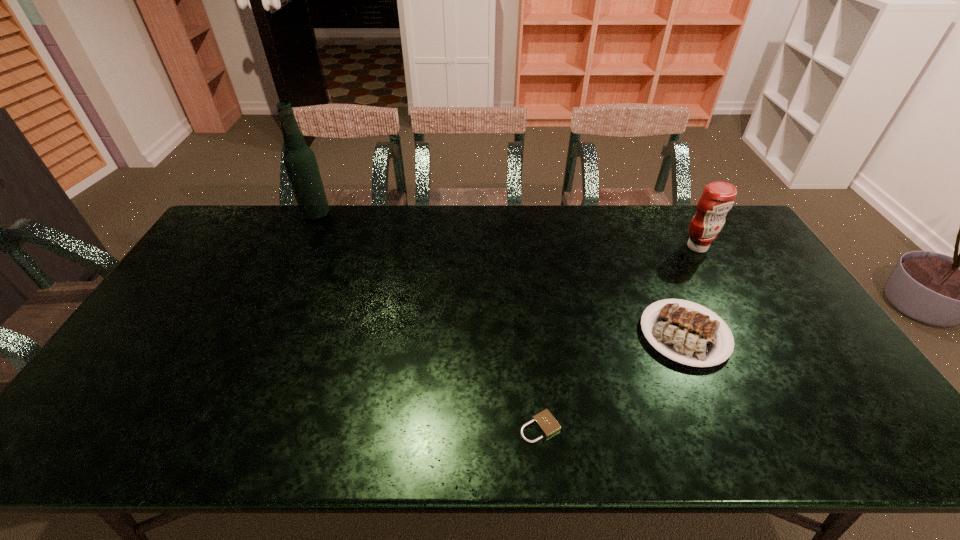
The width and height of the screenshot is (960, 540). In the image, there is a desktop. In order to click on vacant area at the far left corner in this screenshot , I will do `click(264, 212)`.

Find the location of a particular element. Image resolution: width=960 pixels, height=540 pixels. free space between the condiment and the plate is located at coordinates (691, 291).

Find the location of `free space between the nearest object and the leftmost object`. free space between the nearest object and the leftmost object is located at coordinates (428, 321).

Locate an element on the screen. The image size is (960, 540). vacant area that lies between the third nearest object and the padlock is located at coordinates (619, 337).

Locate an element on the screen. vacant space that's between the second nearest object and the second tallest object is located at coordinates (691, 291).

Locate an element on the screen. This screenshot has width=960, height=540. empty location between the alcohol and the third farthest object is located at coordinates [x=500, y=275].

The width and height of the screenshot is (960, 540). Find the location of `free area in between the plate and the alcohol`. free area in between the plate and the alcohol is located at coordinates (500, 275).

Locate an element on the screen. The height and width of the screenshot is (540, 960). free point between the second nearest object and the third nearest object is located at coordinates (691, 291).

The width and height of the screenshot is (960, 540). I want to click on free point between the plate and the tallest object, so click(500, 275).

At what (x,y) coordinates should I click in order to perform the action: click on vacant point located between the condiment and the padlock. Please return your answer as a coordinate pair (x, y). The width and height of the screenshot is (960, 540). Looking at the image, I should click on (619, 337).